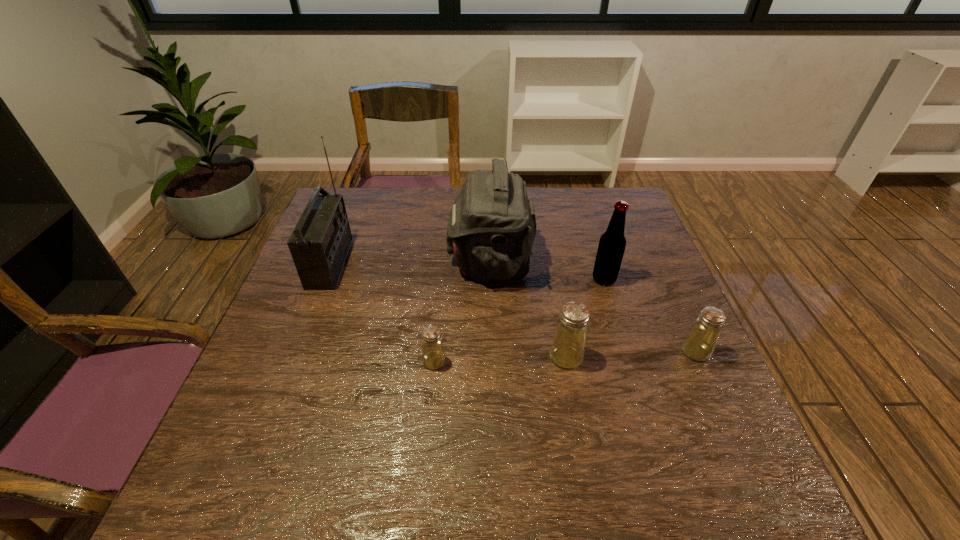
Find the location of `object that is the fifth closest to the radio receiver`. object that is the fifth closest to the radio receiver is located at coordinates (699, 344).

Where is `object identified as the second closest to the rightmost object`? object identified as the second closest to the rightmost object is located at coordinates (567, 350).

I want to click on saltshaker identified as the second closest to the leftmost saltshaker, so click(x=699, y=344).

Select which saltshaker is the closest to the fifth object from left to right. Please provide its 2D coordinates. Your answer should be formatted as a tuple, i.e. [(x, y)], where the tuple contains the x and y coordinates of a point satisfying the conditions above.

[(567, 350)]

Find the location of a particular element. This screenshot has width=960, height=540. free space that satisfies the following two spatial constraints: 1. on the open flap of the beer bottle; 2. on the right side of the second tallest object is located at coordinates (491, 279).

This screenshot has width=960, height=540. I want to click on vacant point that satisfies the following two spatial constraints: 1. on the back side of the second saltshaker from left to right; 2. on the open flap of the shoulder bag, so click(x=549, y=261).

Where is `vacant region that satisfies the following two spatial constraints: 1. on the front panel of the shortest object; 2. on the right side of the radio receiver`? This screenshot has height=540, width=960. vacant region that satisfies the following two spatial constraints: 1. on the front panel of the shortest object; 2. on the right side of the radio receiver is located at coordinates (292, 361).

Locate an element on the screen. Image resolution: width=960 pixels, height=540 pixels. vacant space that satisfies the following two spatial constraints: 1. on the front panel of the leftmost saltshaker; 2. on the right side of the leftmost object is located at coordinates (292, 361).

What are the coordinates of `free spot that satisfies the following two spatial constraints: 1. on the open flap of the fifth shortest object; 2. on the front side of the leftmost saltshaker` in the screenshot? It's located at (492, 361).

At what (x,y) coordinates should I click in order to perform the action: click on vacant space that satisfies the following two spatial constraints: 1. on the open flap of the shoulder bag; 2. on the right side of the beer bottle. Please return your answer as a coordinate pair (x, y). Looking at the image, I should click on (491, 279).